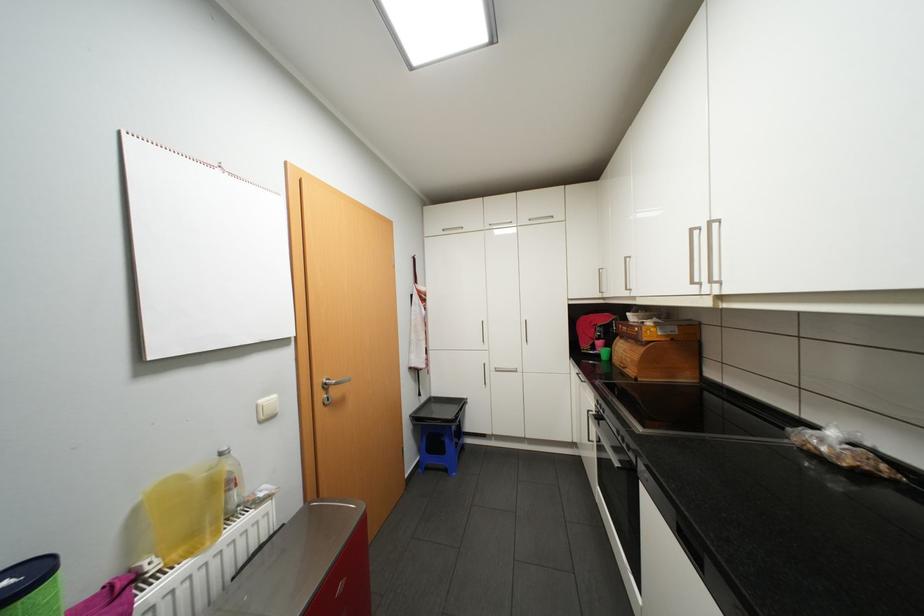
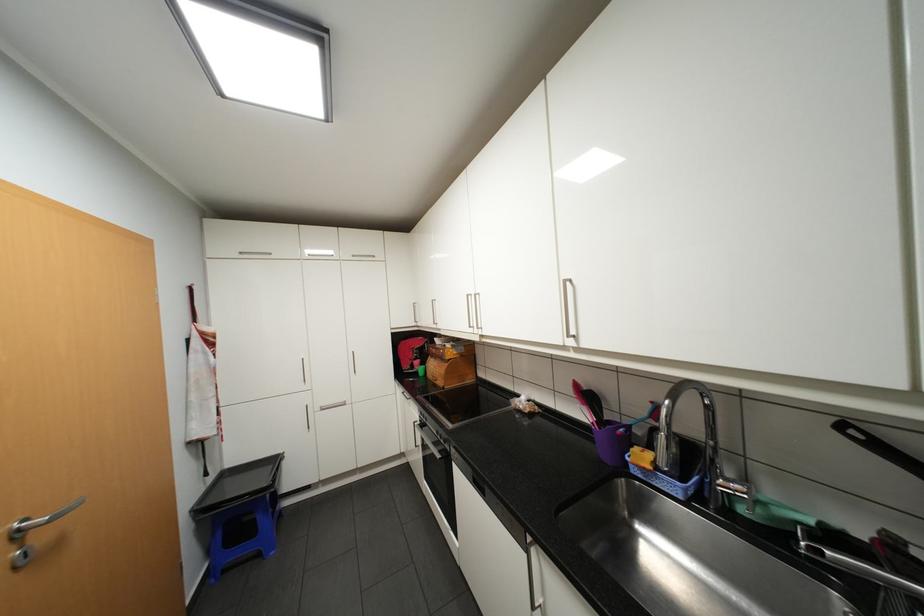
The point at (431,398) is marked in the first image. Where is the corresponding point in the second image?

(220, 476)